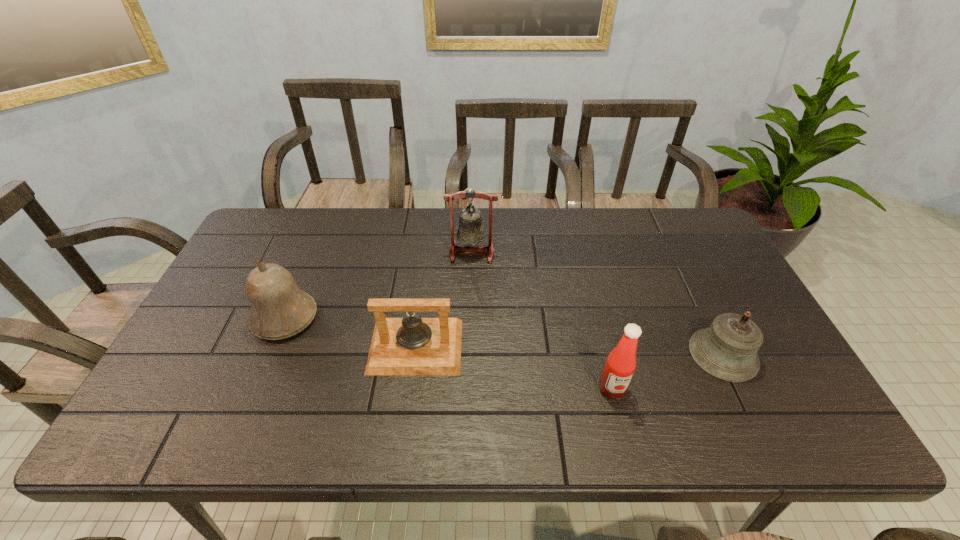
You are a GUI agent. You are given a task and a screenshot of the screen. Output one action in this format:
    pyautogui.click(x=<x>, y=<y>)
    Task: Click on the farthest bell
    Image resolution: width=960 pixels, height=540 pixels.
    Given the screenshot: What is the action you would take?
    coord(470,231)

Find the location of a particular element. condiment is located at coordinates coord(620,365).

Where is `the leftmost bell`? The height and width of the screenshot is (540, 960). the leftmost bell is located at coordinates (279, 308).

You are a GUI agent. You are given a task and a screenshot of the screen. Output one action in this format:
    pyautogui.click(x=<x>, y=<y>)
    Task: Click on the rightmost bell
    Image resolution: width=960 pixels, height=540 pixels.
    Given the screenshot: What is the action you would take?
    (x=727, y=350)

I want to click on vacant space located 0.080m on the front of the farthest bell, so click(471, 282).

This screenshot has width=960, height=540. Identify the location of vacant space located on the back of the leftmost bell. (310, 258).

The width and height of the screenshot is (960, 540). I want to click on vacant point located 0.200m on the left of the rightmost object, so click(x=611, y=354).

Where is `object positioned at the far edge`? object positioned at the far edge is located at coordinates coord(470,231).

Identify the location of object that is at the left edge. (279, 308).

You are a GUI agent. You are given a task and a screenshot of the screen. Output one action in this format:
    pyautogui.click(x=<x>, y=<y>)
    Task: Click on the object located at the right edge
    The height and width of the screenshot is (540, 960).
    Given the screenshot: What is the action you would take?
    727,350